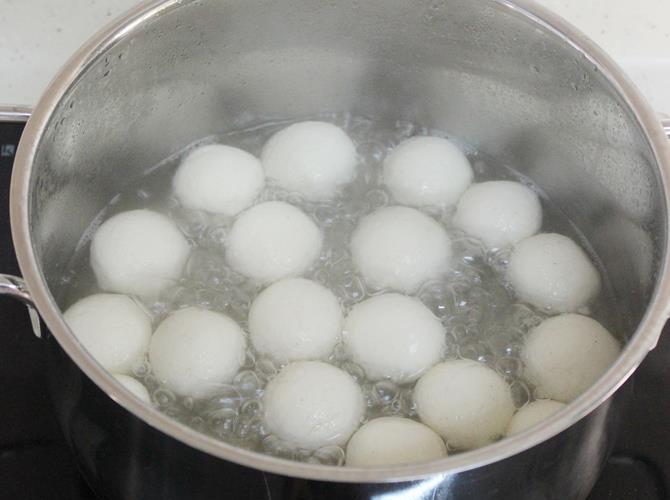
I want to click on handle, so click(5, 281).